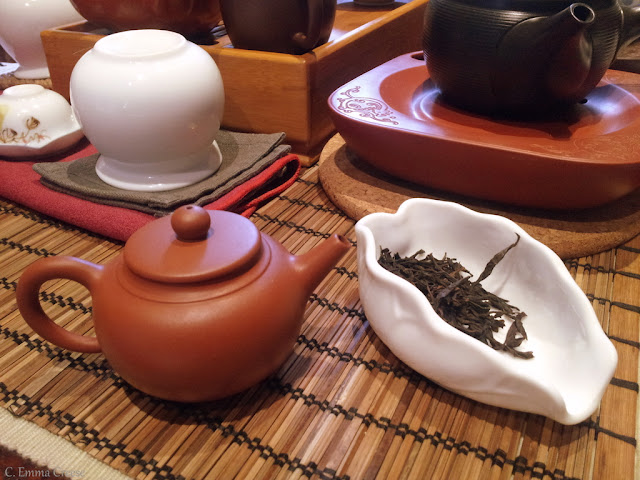
You are a GUI agent. You are given a task and a screenshot of the screen. Output one action in this format:
    pyautogui.click(x=<x>, y=<y>)
    Task: Click on the towels
    
    Given the screenshot: What is the action you would take?
    pyautogui.click(x=248, y=184), pyautogui.click(x=251, y=162)